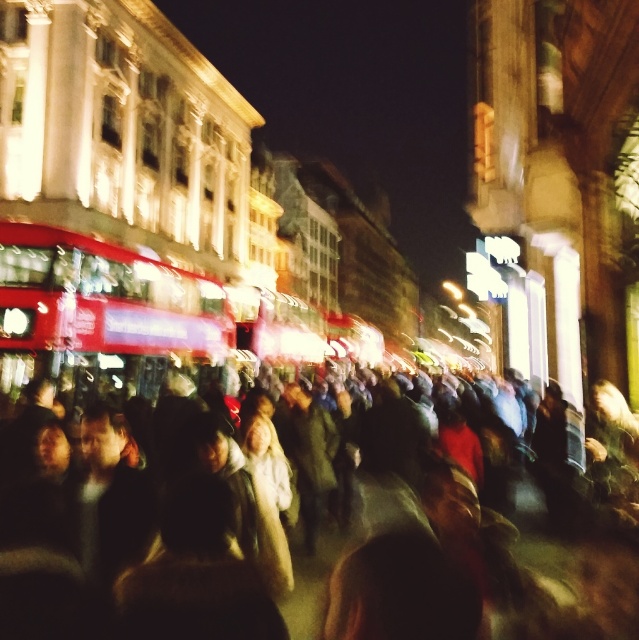
You are standing in the middle of the bustling urban scene at night. There are two points marked on the ground in front of you, one at coordinates point [452,520] and the other at point [190,356]. Which point is closer to your current position?

Point [452,520] is closer to the viewer than point [190,356].

You are a photographer standing in the middle of a busy street at night. You want to take a photo of the multicolored fabric crowd at center and the red metallic bus at center. Which object should you focus on first to ensure both are in focus?

The multicolored fabric crowd at center is located below the red metallic bus at center. To ensure both are in focus, you should focus on the red metallic bus at center first since it is farther away, and the depth of field will naturally include the closer crowd.